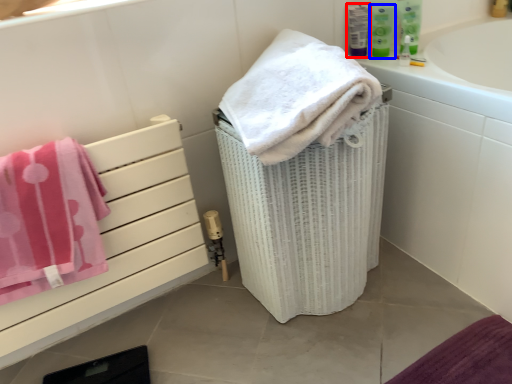
Question: Which of the following is the closest to the observer, mouthwash (highlighted by a red box) or mouthwash (highlighted by a blue box)?

Choices:
 (A) mouthwash
 (B) mouthwash

Answer: (B)